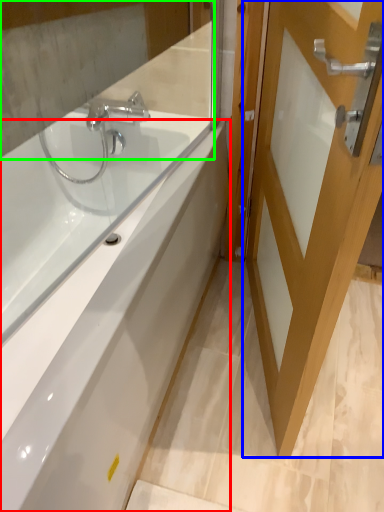
Question: Based on their relative distances, which object is nearer to bathtub (highlighted by a red box)? Choose from door (highlighted by a blue box) and mirror (highlighted by a green box).

Choices:
 (A) door
 (B) mirror

Answer: (A)